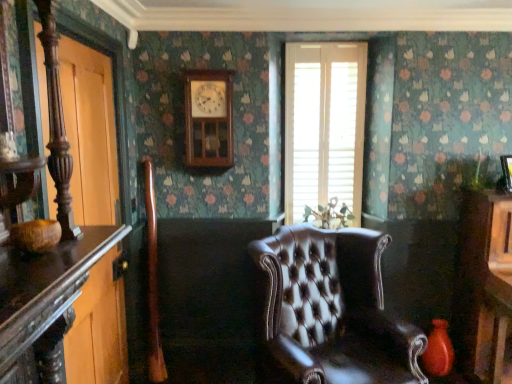
Question: Choose the correct answer: Is white wood blinds at center inside brown leather chair at center or outside it?

Choices:
 (A) outside
 (B) inside

Answer: (A)

Question: From their relative heights in the image, would you say white wood blinds at center is taller or shorter than brown leather chair at center?

Choices:
 (A) short
 (B) tall

Answer: (B)

Question: Estimate the real-world distances between objects in this image. Which object is closer to the white wood blinds at center?

Choices:
 (A) brown leather chair at center
 (B) matte red vase at lower right
 (C) green glossy plant at center
 (D) wooden clock at upper center

Answer: (C)

Question: Estimate the real-world distances between objects in this image. Which object is closer to the green glossy plant at center?

Choices:
 (A) white wood blinds at center
 (B) matte red vase at lower right
 (C) wooden clock at upper center
 (D) brown leather chair at center

Answer: (A)